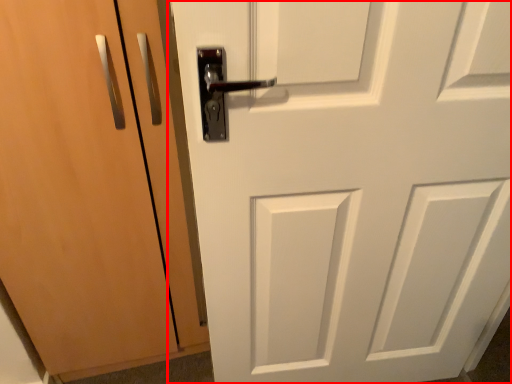
Question: From the image's perspective, what is the correct spatial relationship of door (annotated by the red box) in relation to door?

Choices:
 (A) above
 (B) below

Answer: (B)